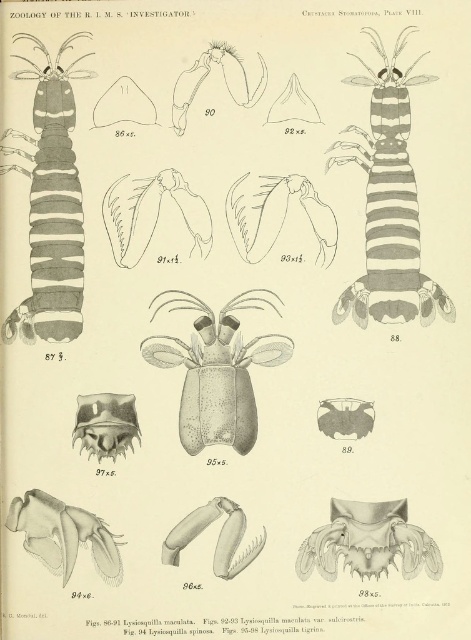
I want to click on striped paper shrimp at left, so click(x=51, y=205).

Can you confirm if striped paper shrimp at left is positioned to the left of matte grayish-brown shrimp at center?

Indeed, striped paper shrimp at left is positioned on the left side of matte grayish-brown shrimp at center.

What do you see at coordinates (51, 205) in the screenshot? I see `striped paper shrimp at left` at bounding box center [51, 205].

Find the location of a particular element. striped paper shrimp at left is located at coordinates (51, 205).

Between point (384, 310) and point (47, 93), which one is positioned in front?

Positioned in front is point (47, 93).

Which is above, striped paper shrimp at upper right or striped paper shrimp at left?

striped paper shrimp at upper right is above.

The height and width of the screenshot is (640, 471). Identify the location of striped paper shrimp at upper right. (389, 204).

Is striped paper shrimp at upper right further to camera compared to matte grayish-brown shrimp at center?

No, it is not.

Locate an element on the screen. Image resolution: width=471 pixels, height=640 pixels. striped paper shrimp at upper right is located at coordinates (389, 204).

Which is in front, point (350, 141) or point (163, 337)?

Point (350, 141) is more forward.

Find the location of a particular element. striped paper shrimp at upper right is located at coordinates (389, 204).